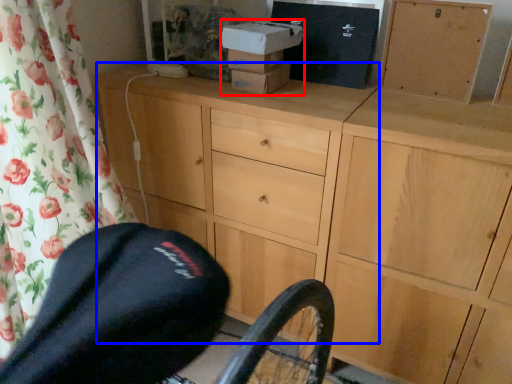
Question: Which point is closer to the camera, box (highlighted by a red box) or chest of drawers (highlighted by a blue box)?

Choices:
 (A) box
 (B) chest of drawers

Answer: (B)